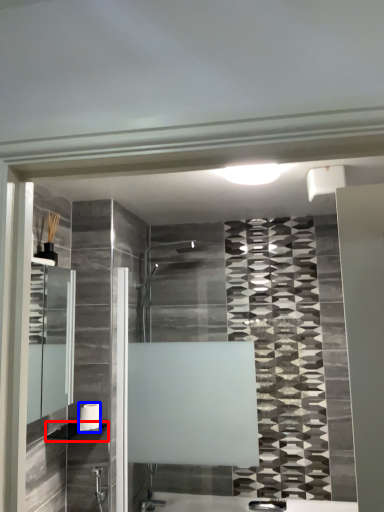
Question: Which object is closer to the camera taking this photo, shelf (highlighted by a red box) or towel bar (highlighted by a blue box)?

Choices:
 (A) shelf
 (B) towel bar

Answer: (A)